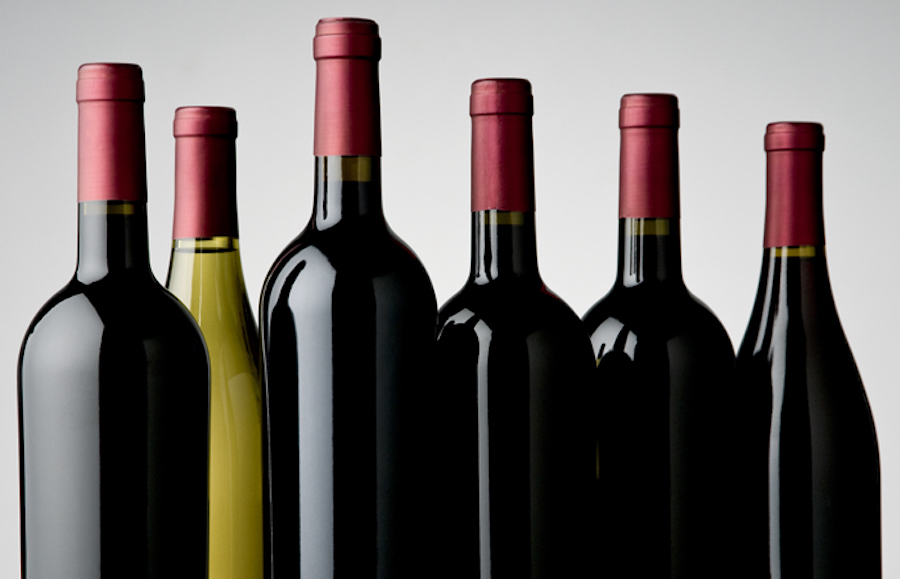
Identify the location of bottles. This screenshot has width=900, height=579. (117, 381), (210, 289), (315, 318), (473, 405), (664, 428), (784, 455).